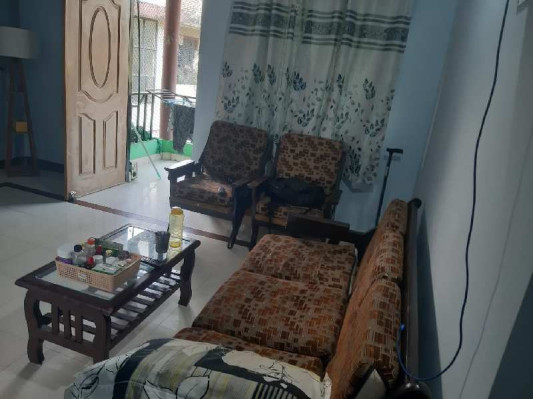
You are a GUI agent. You are given a task and a screenshot of the screen. Output one action in this format:
    pyautogui.click(x=<x>, y=<y>)
    Task: Click on the pillow on sofa
    The height and width of the screenshot is (399, 533).
    Given the screenshot: What is the action you would take?
    pyautogui.click(x=224, y=380)